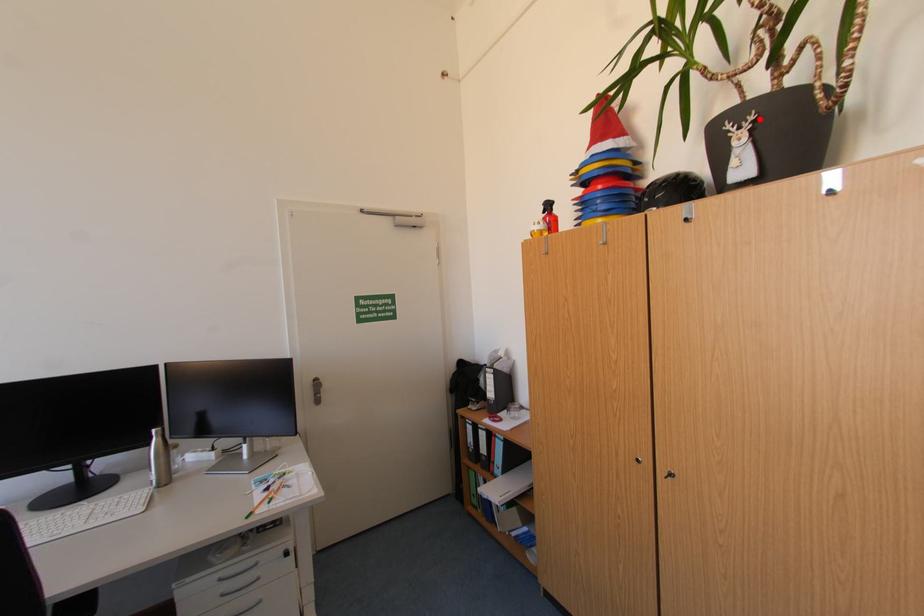
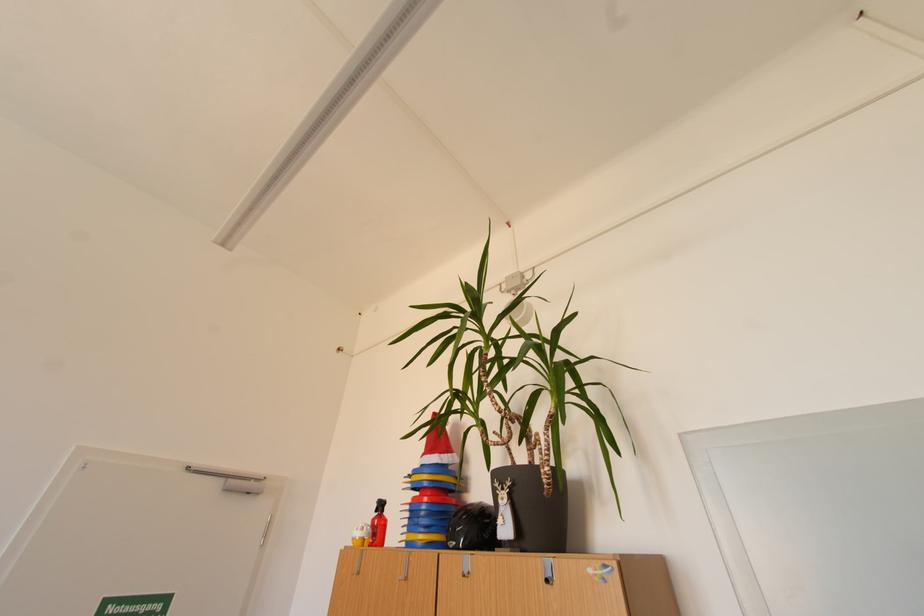
Locate, in the second image, the point that corresponds to the highlighted location in the first image.

(517, 485)